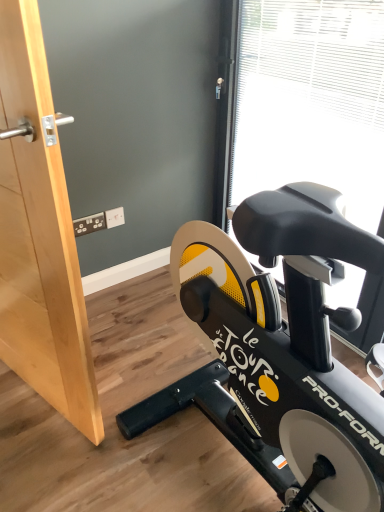
This screenshot has width=384, height=512. In order to click on vacant area on top of black matte stationary bicycle at lower right (from a real-world perspective) in this screenshot , I will do `click(122, 403)`.